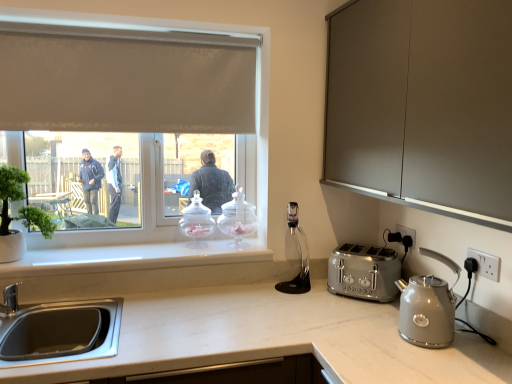
I want to click on free location in front of clear glass jar at window, the first kitchen appliance positioned from the left, so click(x=179, y=253).